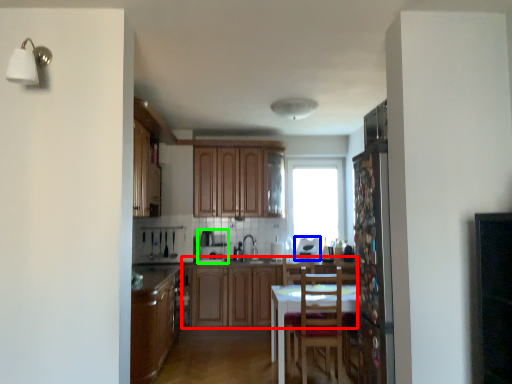
Question: Considering the real-world distances, which object is closest to cabinetry (highlighted by a red box)? appliance (highlighted by a blue box) or appliance (highlighted by a green box).

Choices:
 (A) appliance
 (B) appliance

Answer: (B)